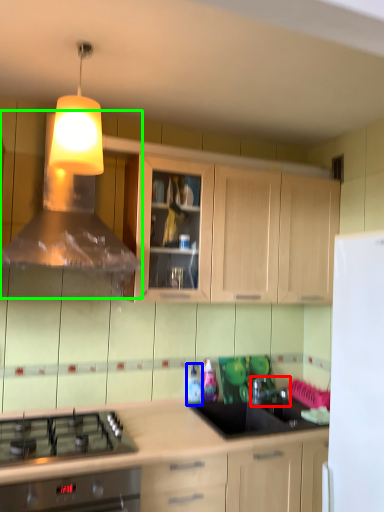
Question: Based on their relative distances, which object is farther from tap (highlighted by a red box)? Choose from bottle (highlighted by a blue box) and vent (highlighted by a green box).

Choices:
 (A) bottle
 (B) vent

Answer: (B)